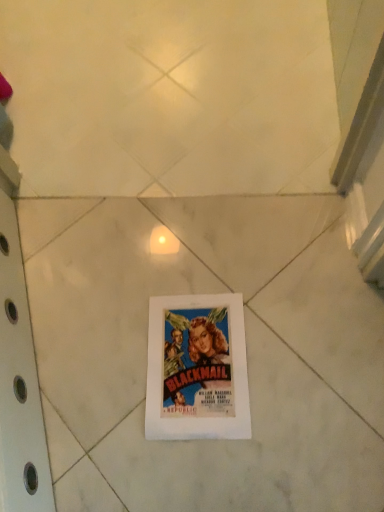
Image resolution: width=384 pixels, height=512 pixels. What are the coordinates of `free spot to the right of white paper at center` in the screenshot? It's located at coord(306,338).